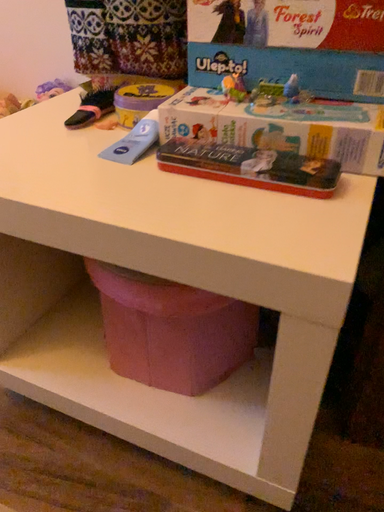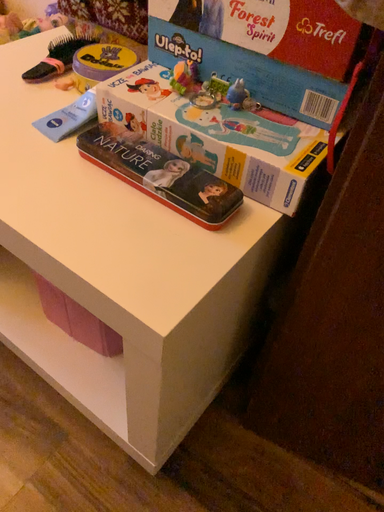
Question: How did the camera likely rotate when shooting the video?

Choices:
 (A) rotated right
 (B) rotated left

Answer: (B)